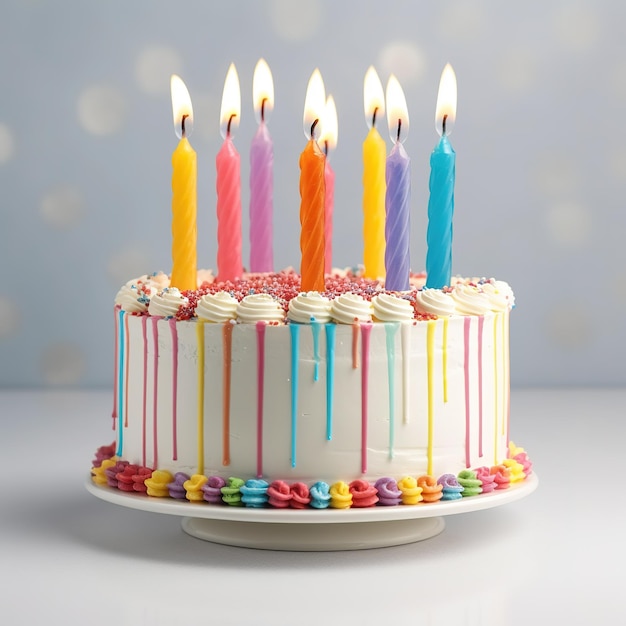
The image size is (626, 626). I want to click on candles, so click(x=434, y=231), click(x=401, y=225), click(x=384, y=230), click(x=321, y=238), click(x=313, y=250), click(x=267, y=230), click(x=225, y=235), click(x=186, y=240).